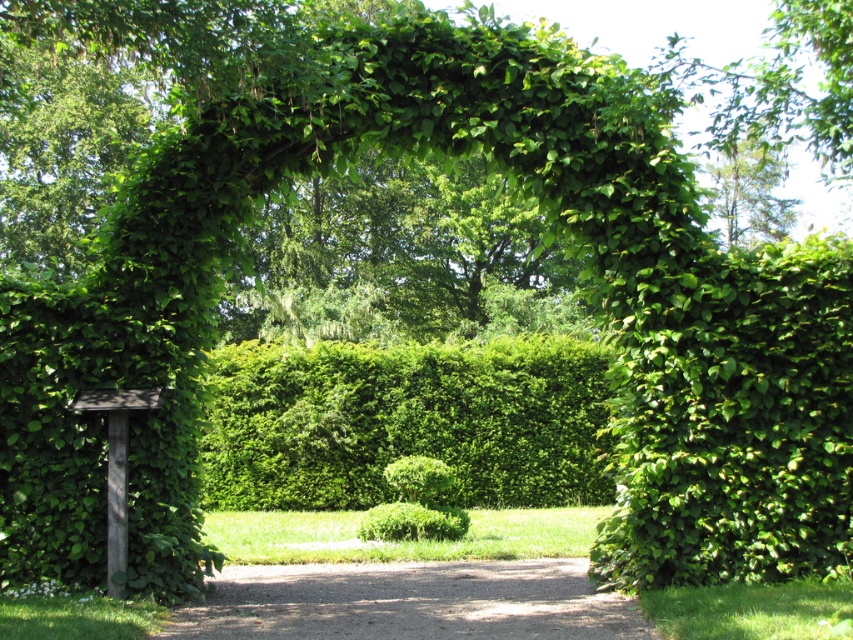
You are designing a garden layout and want to know if the green leafy hedge at center can fit in the space allocated for it. The space you have is the same size as the brown gravel path at center. Can the hedge fit?

The green leafy hedge at center occupies less space than the brown gravel path at center, so yes, the hedge can fit in the allocated space.

You are designing a garden layout and want to place a new statue between the green leafy hedge at center and the green leafy tree at upper center. Based on their sizes, which object should the statue be closer to?

The green leafy hedge at center occupies less space than the green leafy tree at upper center, so the statue should be placed closer to the hedge to balance the sizes of the objects.

You are a gardener planning to install a new sprinkler system in the garden. The sprinkler needs to cover the entire area of the brown gravel path at center and the green leafy tree at upper center. Considering their sizes, which area requires a larger sprinkler coverage?

The green leafy tree at upper center requires a larger sprinkler coverage because it is taller than the brown gravel path at center.